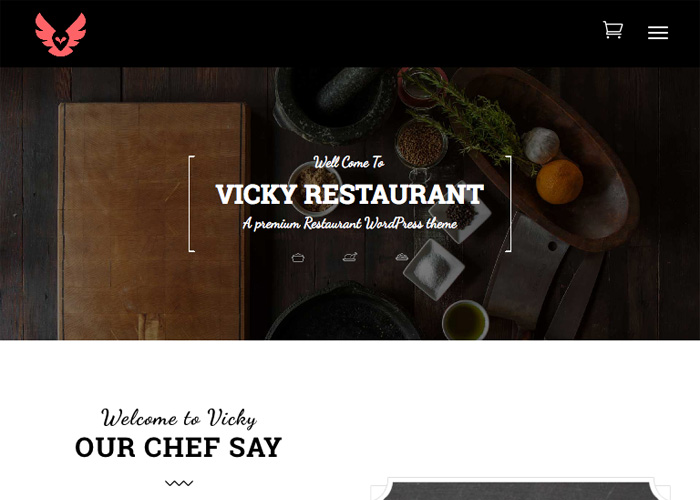
Locate an element on the screen. The height and width of the screenshot is (500, 700). wooden bowl is located at coordinates (586, 148).